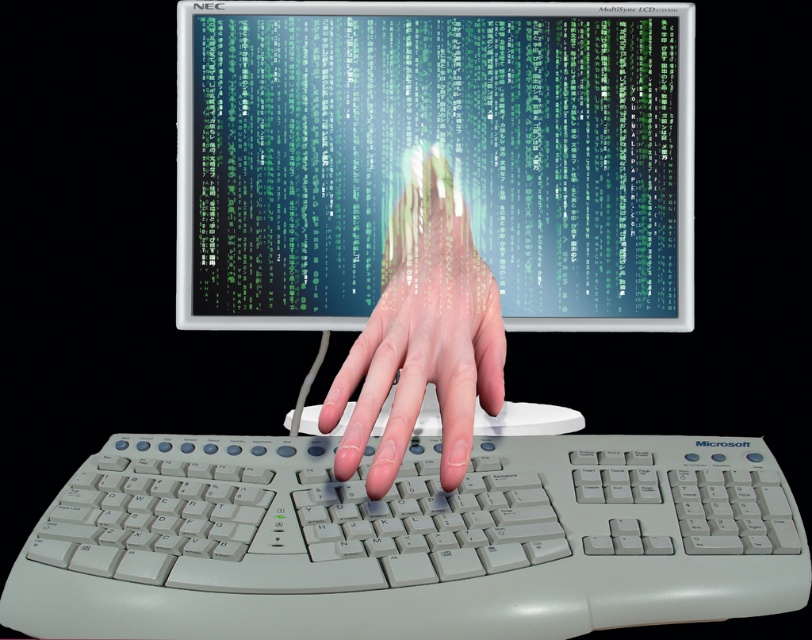
You are a robot trying to reach the point at coordinates point (543, 256) from your current position. The distance between you and the point is 65.64 centimeters. Can you reach it if your maximum reach is 60 centimeters?

The distance between you and the point (543, 256) is 65.64 centimeters, which exceeds your maximum reach of 60 centimeters. Therefore, you cannot reach it.

You are a virtual assistant trying to reach the keyboard in the image. The distance between the green matrix code at center and the white plastic keyboard at center is crucial for your operation. Can you confirm if the distance is sufficient for you to interact with the keyboard without interference from the code display?

The green matrix code at center and white plastic keyboard at center are 8.72 inches apart from each other, which should be sufficient for the virtual assistant to interact with the keyboard without interference from the code display.